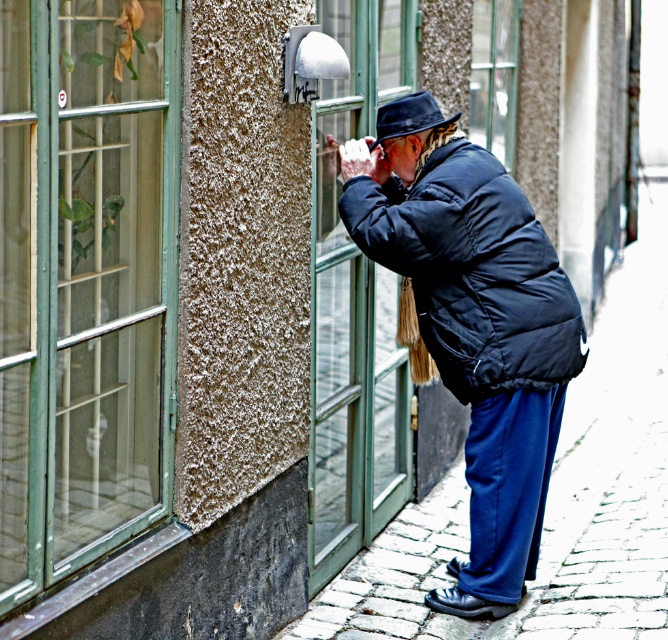
Question: Which of the following is the farthest from the observer?

Choices:
 (A) (619, 296)
 (B) (379, 129)
 (C) (164, 212)
 (D) (375, 340)

Answer: (A)

Question: Is cobblestone pavement at center smaller than matte black jacket at center?

Choices:
 (A) no
 (B) yes

Answer: (A)

Question: Which object is farther from the camera taking this photo?

Choices:
 (A) clear glass window at center
 (B) green glass window at left
 (C) matte black jacket at center

Answer: (A)

Question: Is green glass window at left positioned before matte black jacket at center?

Choices:
 (A) no
 (B) yes

Answer: (B)

Question: Does green glass window at left appear under cobblestone pavement at center?

Choices:
 (A) no
 (B) yes

Answer: (A)

Question: Which point is farther to the camera?

Choices:
 (A) black felt hat at center
 (B) green glass window at center

Answer: (A)